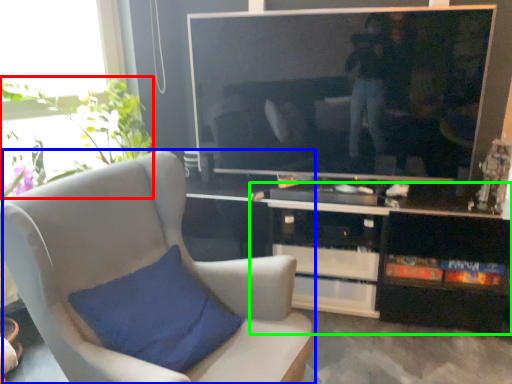
Question: Which object is the closest to the plant (highlighted by a red box)? Choose among these: chair (highlighted by a blue box) or cabinetry (highlighted by a green box).

Choices:
 (A) chair
 (B) cabinetry

Answer: (A)